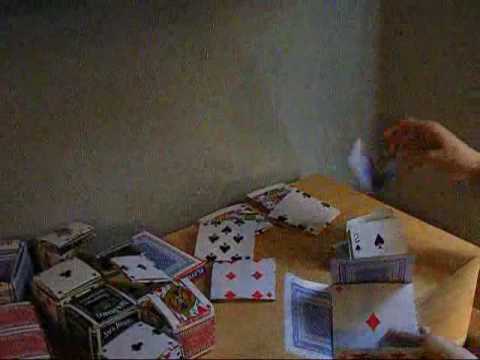
This screenshot has height=360, width=480. What are the coordinates of `card box` in the screenshot? It's located at (188, 262).